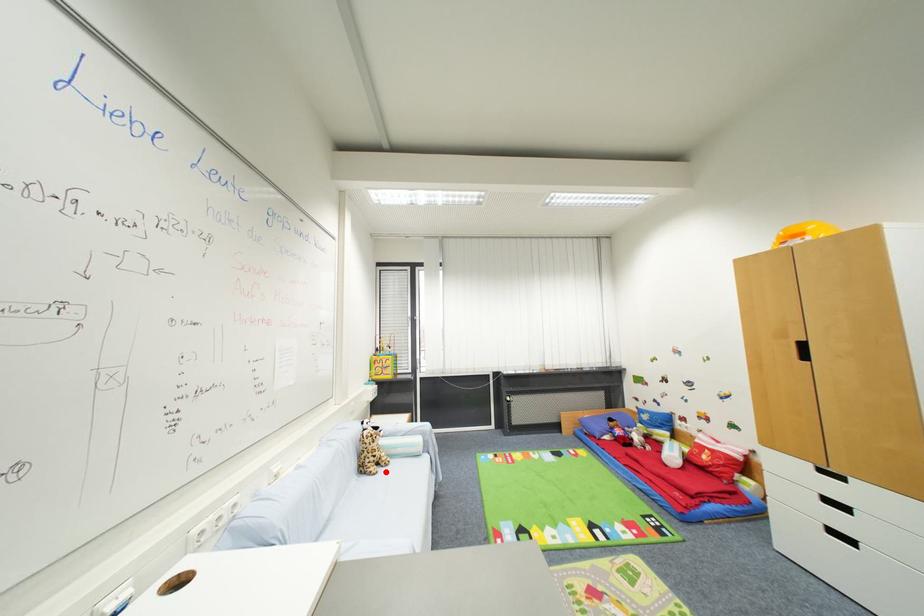
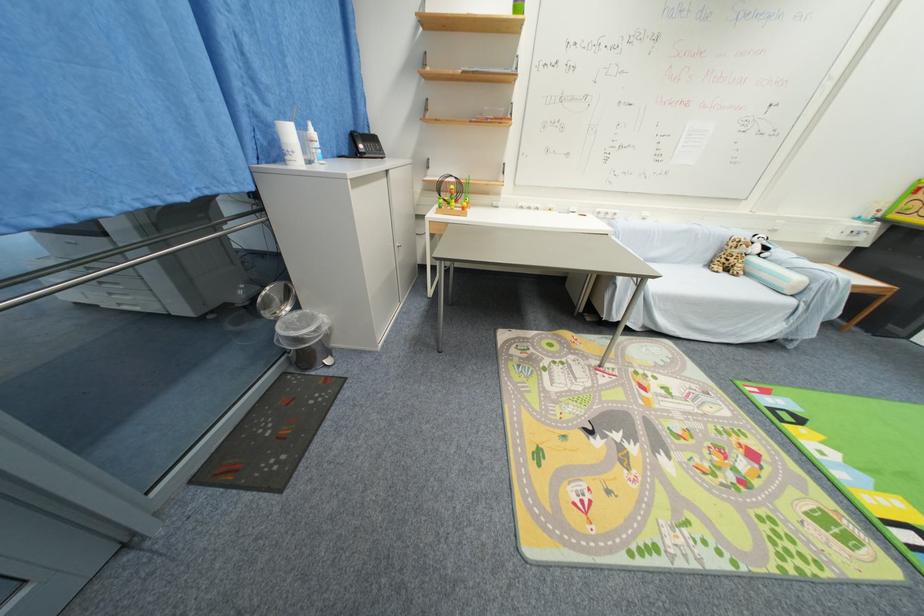
Question: I am providing you with two images of the same scene from different viewpoints. In image1, a red point is highlighted. Considering the same 3D point in image2, which of the following is correct?

Choices:
 (A) It is closer
 (B) It is farther

Answer: (A)